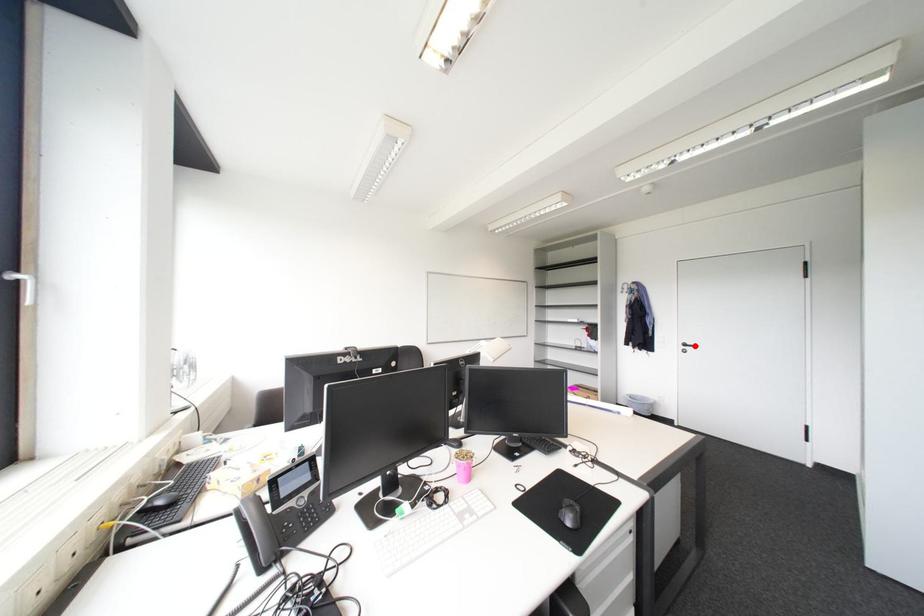
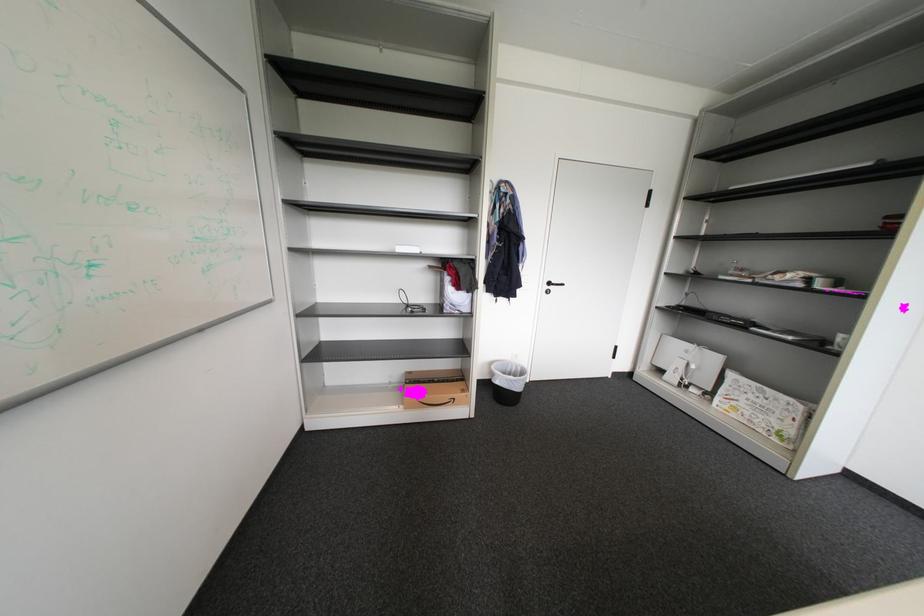
Question: I am providing you with two images of the same scene from different viewpoints. A red point is marked on the first image. At the location where the point appears in image 1, is it still visible in image 2?

Choices:
 (A) Yes
 (B) No

Answer: (A)